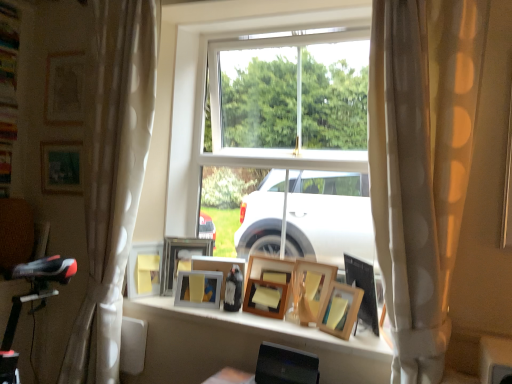
Where is `vacant space situated on the left part of wooden picture frame at center, acting as the ninth picture frame starting from the left`? The height and width of the screenshot is (384, 512). vacant space situated on the left part of wooden picture frame at center, acting as the ninth picture frame starting from the left is located at coordinates (297, 327).